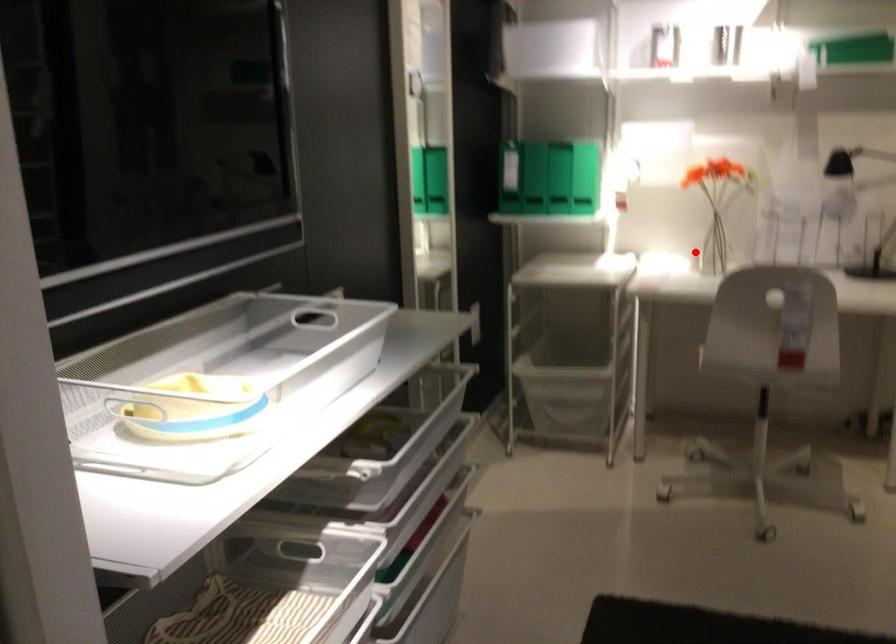
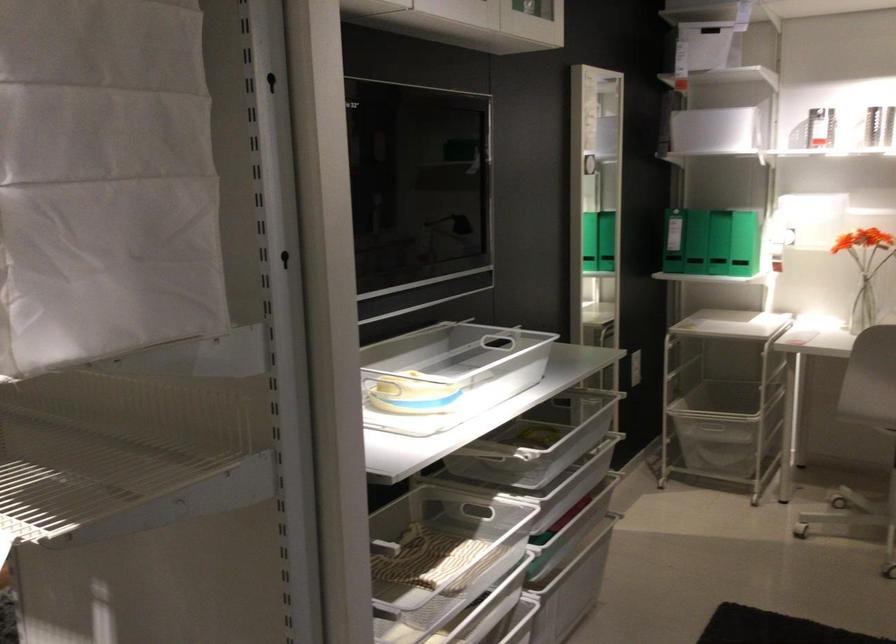
Where in the second image is the point corresponding to the highlighted location from the first image?

(864, 308)